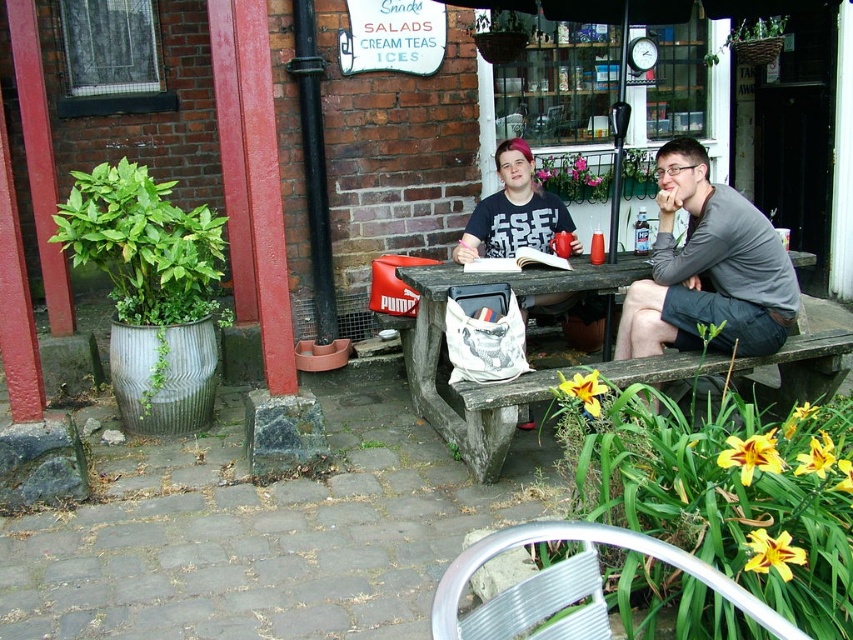
Question: Is the position of gray cotton shirt at center more distant than that of wooden picnic table at center?

Choices:
 (A) no
 (B) yes

Answer: (B)

Question: Among these points, which one is nearest to the camera?

Choices:
 (A) (686, 289)
 (B) (430, 275)

Answer: (A)

Question: Which object appears farthest from the camera in this image?

Choices:
 (A) wooden picnic table at center
 (B) gray cotton shirt at center

Answer: (B)

Question: Is gray cotton shirt at center smaller than wooden picnic table at center?

Choices:
 (A) yes
 (B) no

Answer: (A)

Question: Is gray cotton shirt at center to the left of wooden picnic table at center from the viewer's perspective?

Choices:
 (A) no
 (B) yes

Answer: (A)